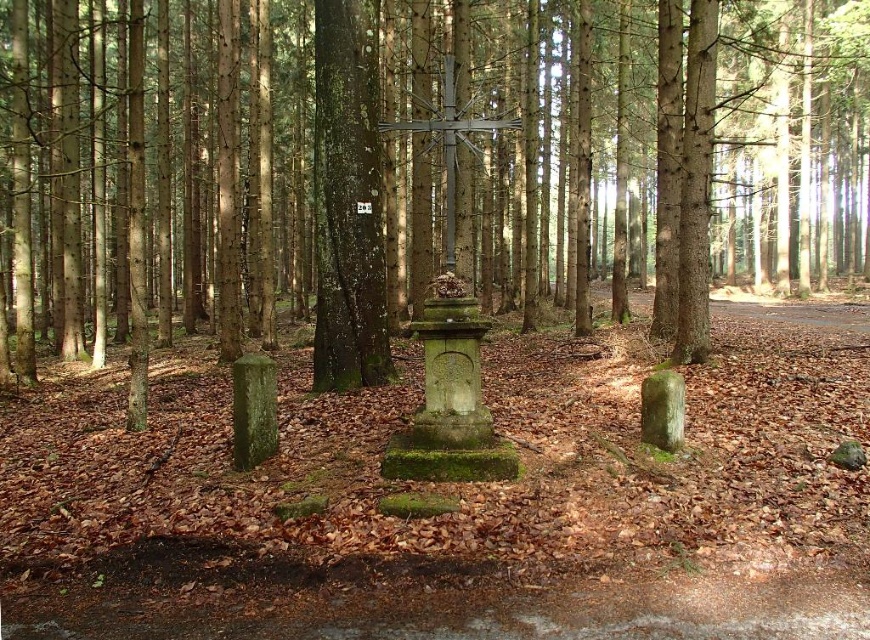
Can you confirm if green mossy stone cross at center is bigger than metallic cross at center?

Yes.

Which of these two, green mossy stone cross at center or metallic cross at center, stands taller?

green mossy stone cross at center

Describe the element at coordinates (513, 163) in the screenshot. I see `green mossy stone cross at center` at that location.

Where is `green mossy stone cross at center`? green mossy stone cross at center is located at coordinates (513, 163).

Can you confirm if green mossy tree trunk at center is taller than metallic cross at center?

No.

You are a GUI agent. You are given a task and a screenshot of the screen. Output one action in this format:
    pyautogui.click(x=<x>, y=<y>)
    Task: Click on the green mossy tree trunk at center
    This screenshot has width=870, height=640.
    Given the screenshot: What is the action you would take?
    348,202

Does point (85, 115) come closer to viewer compared to point (326, 92)?

That is False.

Can you confirm if green mossy stone cross at center is positioned to the right of green mossy tree trunk at center?

Indeed, green mossy stone cross at center is positioned on the right side of green mossy tree trunk at center.

At what (x,y) coordinates should I click in order to perform the action: click on green mossy stone cross at center. Please return your answer as a coordinate pair (x, y). The width and height of the screenshot is (870, 640). Looking at the image, I should click on (513, 163).

You are a GUI agent. You are given a task and a screenshot of the screen. Output one action in this format:
    pyautogui.click(x=<x>, y=<y>)
    Task: Click on the green mossy stone cross at center
    
    Given the screenshot: What is the action you would take?
    [513, 163]